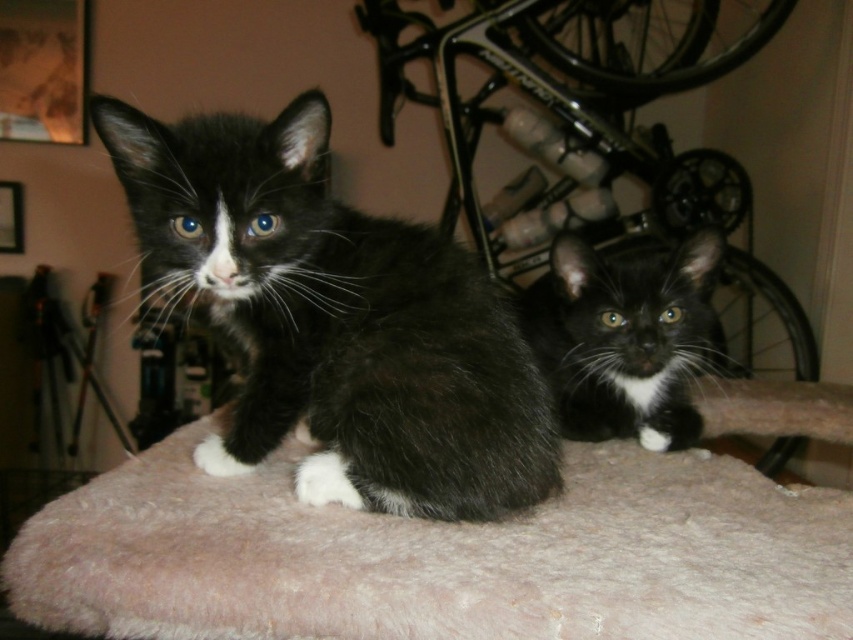
Can you confirm if fuzzy pink cat bed at center is bigger than black fuzzy cat at center?

Indeed, fuzzy pink cat bed at center has a larger size compared to black fuzzy cat at center.

The height and width of the screenshot is (640, 853). I want to click on fuzzy pink cat bed at center, so click(x=438, y=556).

Between black fuzzy cat at center and black fur cat at center, which one has more height?

Standing taller between the two is black fuzzy cat at center.

Who is more forward, (257,397) or (560,355)?

Positioned in front is point (257,397).

What do you see at coordinates (337, 320) in the screenshot? I see `black fuzzy cat at center` at bounding box center [337, 320].

At what (x,y) coordinates should I click in order to perform the action: click on black fuzzy cat at center. Please return your answer as a coordinate pair (x, y). The height and width of the screenshot is (640, 853). Looking at the image, I should click on (337, 320).

Is fuzzy pink cat bed at center further to camera compared to black fur cat at center?

That is False.

From the picture: Which is more to the right, fuzzy pink cat bed at center or black fur cat at center?

Positioned to the right is black fur cat at center.

Identify the location of fuzzy pink cat bed at center. The height and width of the screenshot is (640, 853). (438, 556).